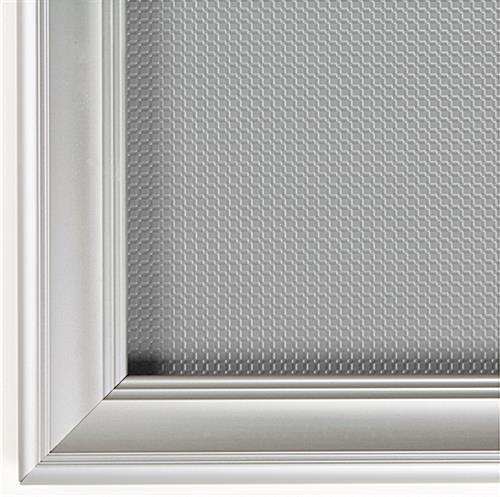
The image size is (500, 497). I want to click on inside of the frame area, so click(171, 45), click(182, 315), click(473, 330), click(468, 35).